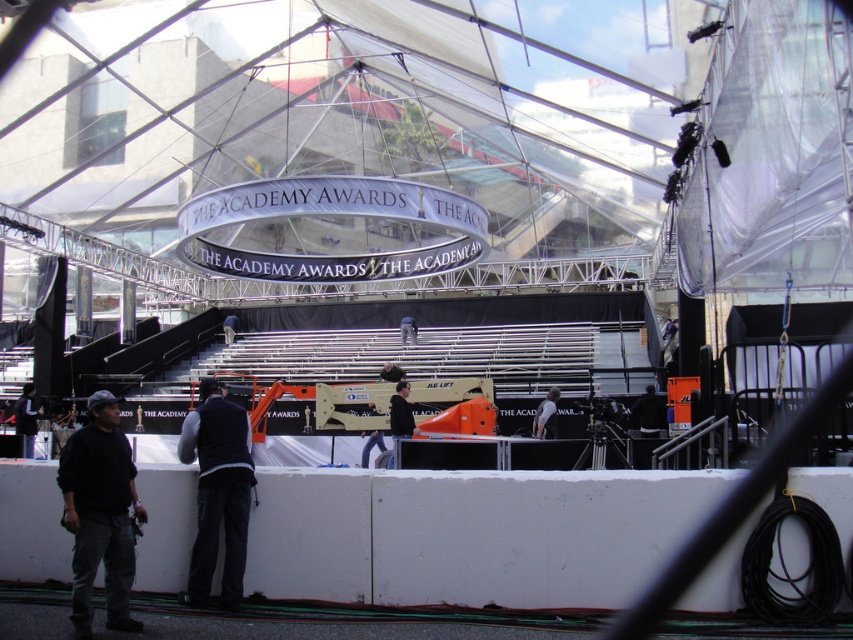
You are a guest at the Academy Awards event and want to see the stage clearly. There is a white matte barrier at lower center and a black fabric vest at lower left in your way. Which object is shorter and might block your view less?

The white matte barrier at lower center is not as tall as the black fabric vest at lower left, so it might block your view less.

You are standing at the Academy Awards event and see two points marked in the scene. Which point, point (97, 548) or point (192, 444), is closer to you?

Point (97, 548) is closer to you than point (192, 444).